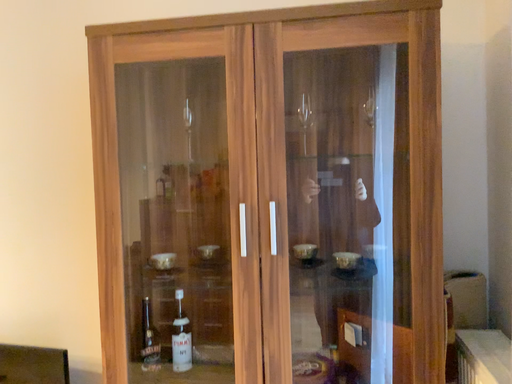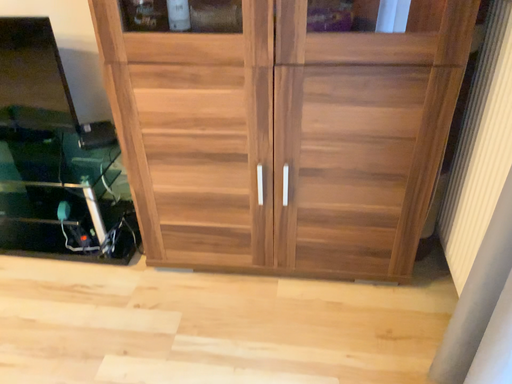
Question: How did the camera likely rotate when shooting the video?

Choices:
 (A) rotated upward
 (B) rotated downward

Answer: (B)